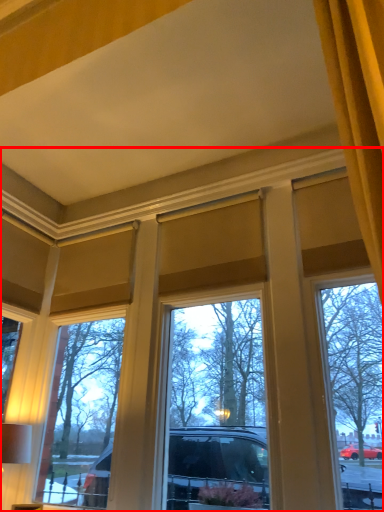
Question: From the image's perspective, what is the correct spatial positioning of window (annotated by the red box) in reference to table lamp?

Choices:
 (A) above
 (B) below

Answer: (A)